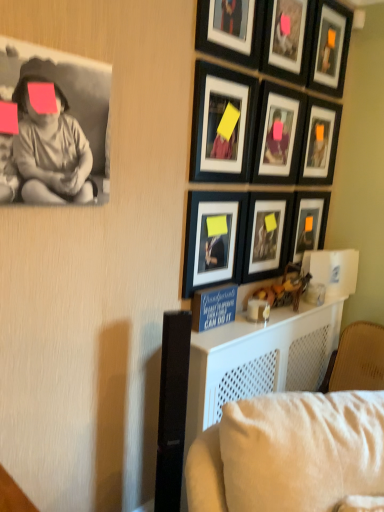
Question: Considering the positions of point (329, 143) and point (86, 139), is point (329, 143) closer or farther from the camera than point (86, 139)?

Choices:
 (A) farther
 (B) closer

Answer: (A)

Question: In terms of width, does matte black picture frame at upper right, which is the 6th picture frame in bottom-to-top order, look wider or thinner when compared to matte black photo of child at upper left?

Choices:
 (A) thin
 (B) wide

Answer: (A)

Question: Estimate the real-world distances between objects in this image. Which object is farther from the matte black picture frame at center-right, acting as the seventh picture frame starting from the top?

Choices:
 (A) matte black picture frame at upper right, which is counted as the 1th picture frame, starting from the top
 (B) matte black picture frame at center, which is the 1th picture frame from bottom to top
 (C) matte black picture frame at center, acting as the 8th picture frame starting from the top
 (D) matte black picture frame at upper right, placed as the 2th picture frame when sorted from top to bottom
 (E) matte black photo of child at upper left

Answer: (E)

Question: Which object is positioned farthest from the matte black picture frame at center, positioned as the second picture frame in bottom-to-top order?

Choices:
 (A) matte black picture frame at upper right, which is counted as the 1th picture frame, starting from the top
 (B) matte black picture frame at upper center, positioned as the 5th picture frame in top-to-bottom order
 (C) matte black picture frame at upper center, the sixth picture frame when ordered from top to bottom
 (D) black matte picture frame at upper center, acting as the third picture frame starting from the top
 (E) matte black picture frame at upper right, placed as the 2th picture frame when sorted from top to bottom

Answer: (A)